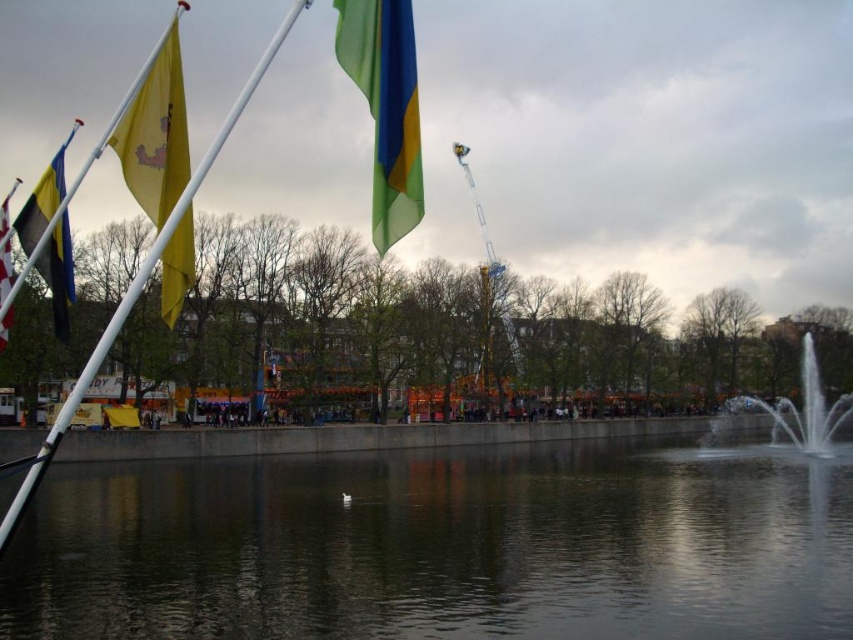
Consider the image. You are standing at the point with coordinates point (x=387, y=148) and want to walk to the point with coordinates point (x=670, y=518). According to the scene, will the path be clear or blocked?

Point (x=670, y=518) is behind point (x=387, y=148), so the path to point (x=670, y=518) will be blocked by point (x=387, y=148).